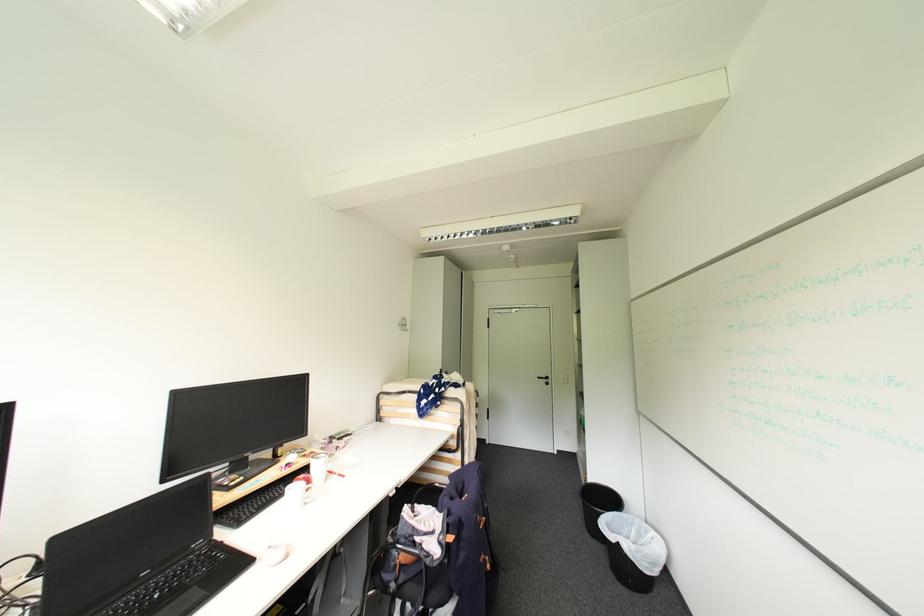
Identify the location of white computer mouse. This screenshot has height=616, width=924. (x=274, y=554).